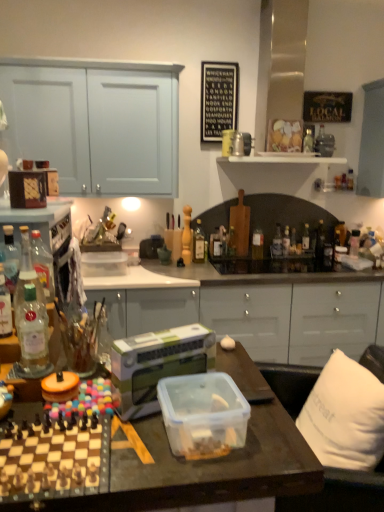
The width and height of the screenshot is (384, 512). In order to click on free space in front of clear glass bottle at center, which ranks as the ninth bottle in left-to-right order in this screenshot , I will do `click(288, 268)`.